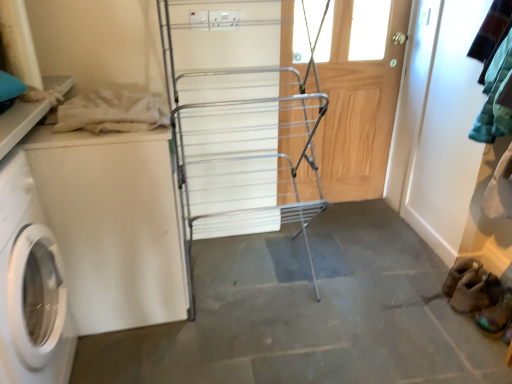
Locate an element on the screen. Image resolution: width=512 pixels, height=384 pixels. free location in front of silver metallic drying rack at center is located at coordinates (249, 348).